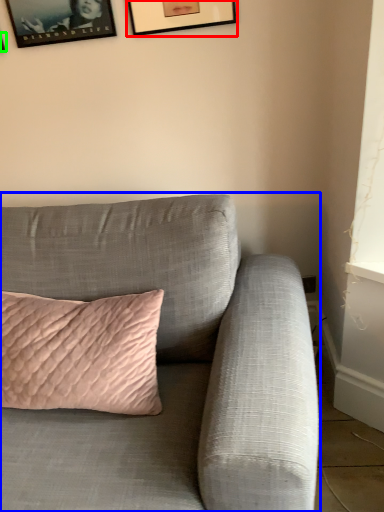
Question: Which object is the closest to the picture frame (highlighted by a red box)? Choose among these: studio couch (highlighted by a blue box) or picture frame (highlighted by a green box).

Choices:
 (A) studio couch
 (B) picture frame

Answer: (B)